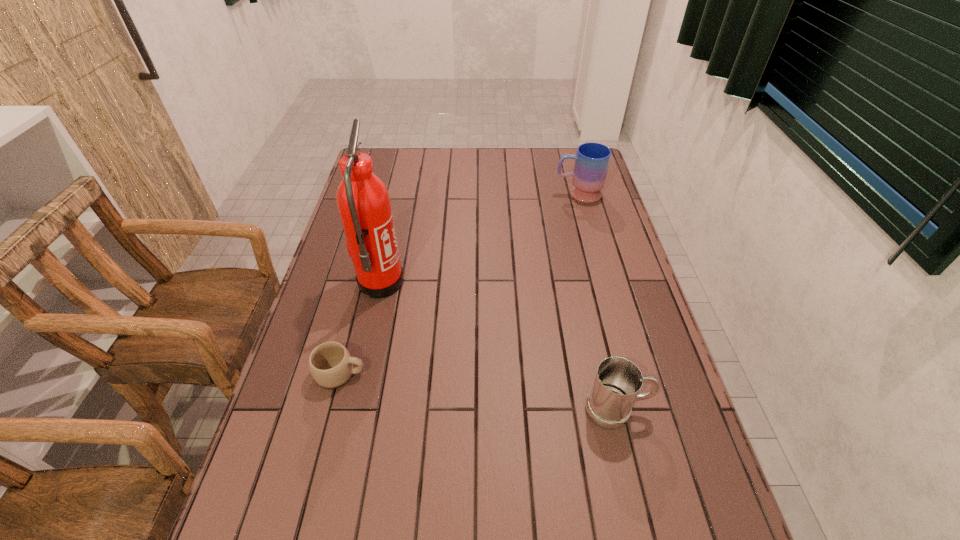
Where is `vacant area that lies between the second shortest object and the farthest object`? vacant area that lies between the second shortest object and the farthest object is located at coordinates (597, 301).

Identify the location of free space between the shortest object and the tallest object. The image size is (960, 540). (360, 328).

The image size is (960, 540). Identify the location of free space between the second shortest mug and the shortest object. (478, 392).

You are a GUI agent. You are given a task and a screenshot of the screen. Output one action in this format:
    pyautogui.click(x=<x>, y=<y>)
    Task: Click on the vacant space that is in between the shortest object and the tallest object
    The width and height of the screenshot is (960, 540).
    Given the screenshot: What is the action you would take?
    pyautogui.click(x=360, y=328)

Locate an element on the screen. This screenshot has width=960, height=540. vacant area that lies between the farthest mug and the third nearest object is located at coordinates (479, 239).

At what (x,y) coordinates should I click in order to perform the action: click on unoccupied area between the shortest mug and the third nearest object. Please return your answer as a coordinate pair (x, y). Looking at the image, I should click on (360, 328).

You are a GUI agent. You are given a task and a screenshot of the screen. Output one action in this format:
    pyautogui.click(x=<x>, y=<y>)
    Task: Click on the vacant area that lies between the farthest object and the fire extinguisher
    Image resolution: width=960 pixels, height=540 pixels.
    Given the screenshot: What is the action you would take?
    pyautogui.click(x=479, y=239)

Identify the location of vacant point located between the farthest mug and the third tallest object. This screenshot has height=540, width=960. (597, 301).

Find the location of a particular element. This screenshot has height=540, width=960. blank region between the tallest mug and the shortest mug is located at coordinates (459, 284).

Identify which object is located as the second nearest to the second shortest mug. Please provide its 2D coordinates. Your answer should be formatted as a tuple, i.e. [(x, y)], where the tuple contains the x and y coordinates of a point satisfying the conditions above.

[(363, 201)]